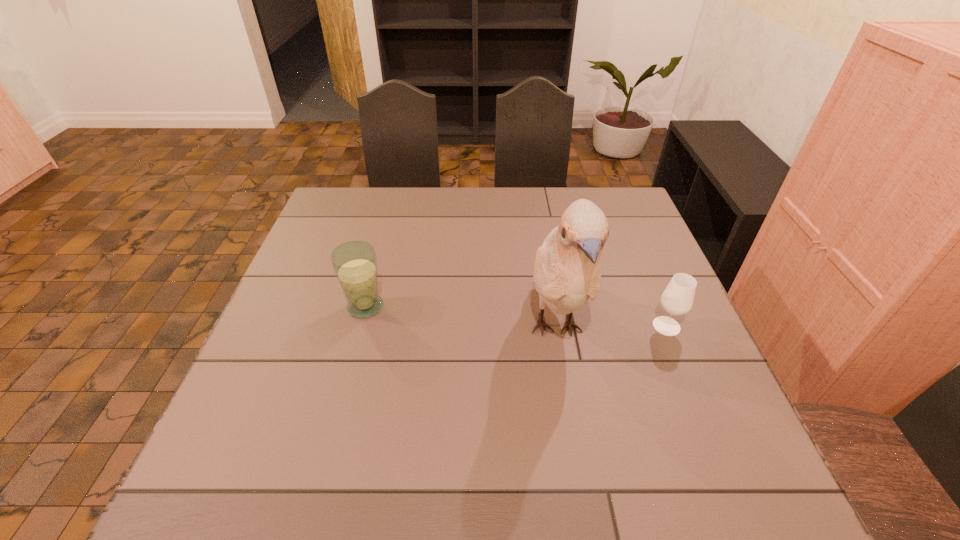
What are the coordinates of `parakeet` in the screenshot? It's located at (567, 272).

This screenshot has width=960, height=540. I want to click on the second object from left to right, so click(x=567, y=272).

The height and width of the screenshot is (540, 960). In order to click on the left glass in this screenshot , I will do click(355, 262).

Identify the location of the rightmost object. (677, 299).

Where is `the shortest object`? Image resolution: width=960 pixels, height=540 pixels. the shortest object is located at coordinates (677, 299).

Where is `vacant space located on the face of the parakeet`? The height and width of the screenshot is (540, 960). vacant space located on the face of the parakeet is located at coordinates (582, 487).

Find the location of a particular element. free space located on the right of the left glass is located at coordinates 535,307.

Find the location of a particular element. vacant space located 0.190m on the back of the shorter glass is located at coordinates (641, 265).

What are the coordinates of `object at the right edge` in the screenshot? It's located at (677, 299).

Where is `vacant space at the far edge`? This screenshot has width=960, height=540. vacant space at the far edge is located at coordinates (461, 214).